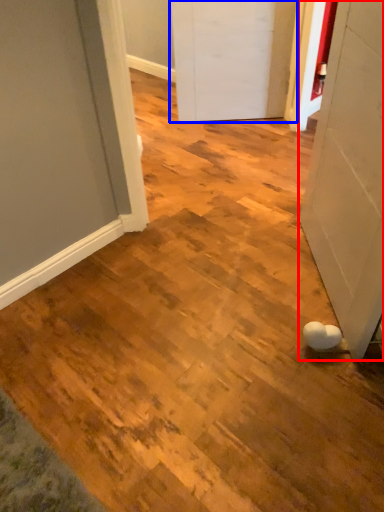
Question: Which point is closer to the camera, door (highlighted by a red box) or door (highlighted by a blue box)?

Choices:
 (A) door
 (B) door

Answer: (A)